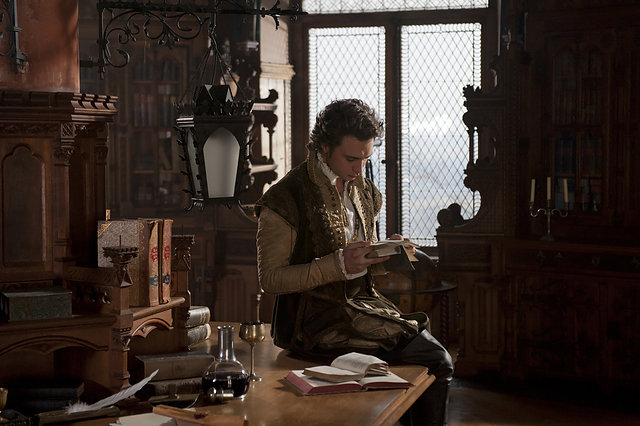
Image resolution: width=640 pixels, height=426 pixels. Find the location of `books`. books is located at coordinates (43, 310), (187, 365), (173, 397), (198, 342), (196, 322), (349, 360), (310, 390), (388, 251).